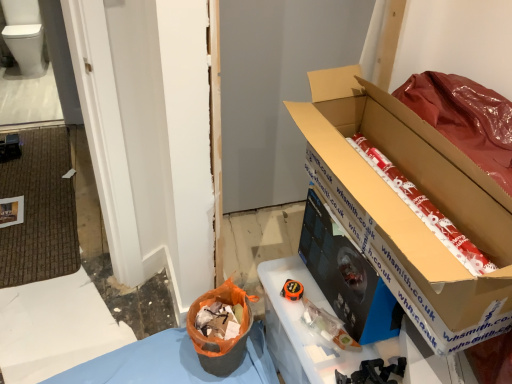
Question: Is red wrapping paper at right to the right of white glossy toilet bowl at upper left from the viewer's perspective?

Choices:
 (A) yes
 (B) no

Answer: (A)

Question: Can you confirm if red wrapping paper at right is smaller than white glossy toilet bowl at upper left?

Choices:
 (A) yes
 (B) no

Answer: (A)

Question: From the image's perspective, does red wrapping paper at right appear higher than white glossy toilet bowl at upper left?

Choices:
 (A) yes
 (B) no

Answer: (B)

Question: Is red wrapping paper at right shorter than white glossy toilet bowl at upper left?

Choices:
 (A) yes
 (B) no

Answer: (A)

Question: Is red wrapping paper at right to the left of white glossy toilet bowl at upper left from the viewer's perspective?

Choices:
 (A) yes
 (B) no

Answer: (B)

Question: Is the surface of red wrapping paper at right in direct contact with white glossy toilet bowl at upper left?

Choices:
 (A) yes
 (B) no

Answer: (B)

Question: From the image's perspective, does red wrapping paper at right appear higher than cardboard box at right?

Choices:
 (A) no
 (B) yes

Answer: (A)

Question: Considering the relative positions of red wrapping paper at right and cardboard box at right in the image provided, is red wrapping paper at right in front of cardboard box at right?

Choices:
 (A) yes
 (B) no

Answer: (B)

Question: Considering the relative sizes of red wrapping paper at right and cardboard box at right in the image provided, is red wrapping paper at right wider than cardboard box at right?

Choices:
 (A) yes
 (B) no

Answer: (A)

Question: Can you confirm if red wrapping paper at right is positioned to the left of cardboard box at right?

Choices:
 (A) no
 (B) yes

Answer: (A)

Question: Is red wrapping paper at right completely or partially outside of cardboard box at right?

Choices:
 (A) yes
 (B) no

Answer: (B)

Question: Can you confirm if red wrapping paper at right is taller than cardboard box at right?

Choices:
 (A) no
 (B) yes

Answer: (A)

Question: From a real-world perspective, is cardboard box at right below orange fabric bag at lower center?

Choices:
 (A) yes
 (B) no

Answer: (B)